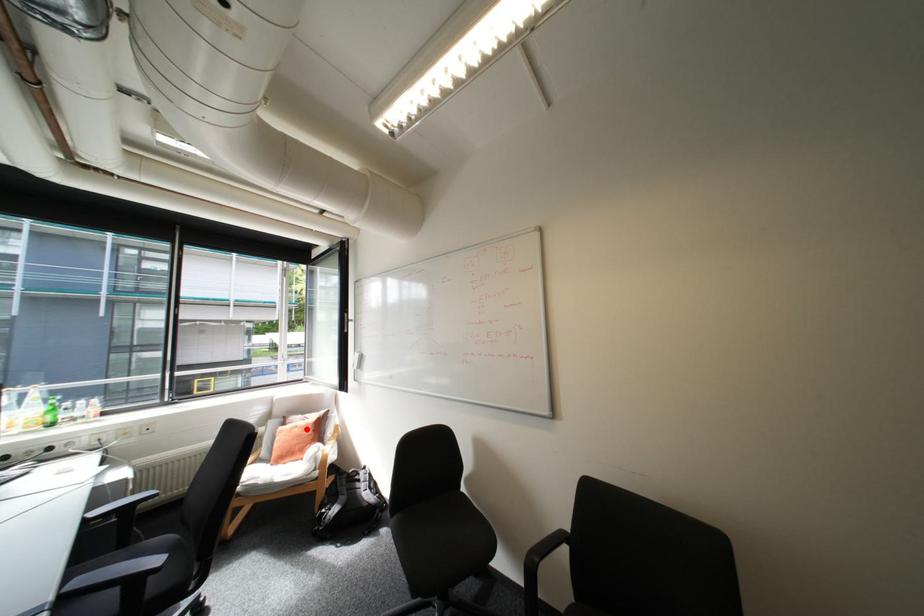
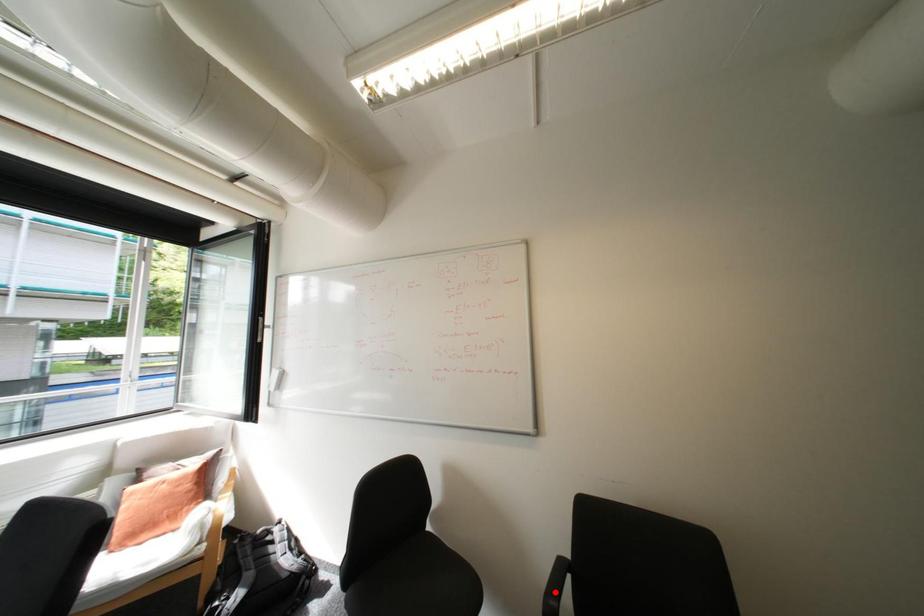
I am providing you with two images of the same scene from different viewpoints. A red point is marked on the first image and another point is marked on the second image. Is the red point in image1 aligned with the point shown in image2?

No